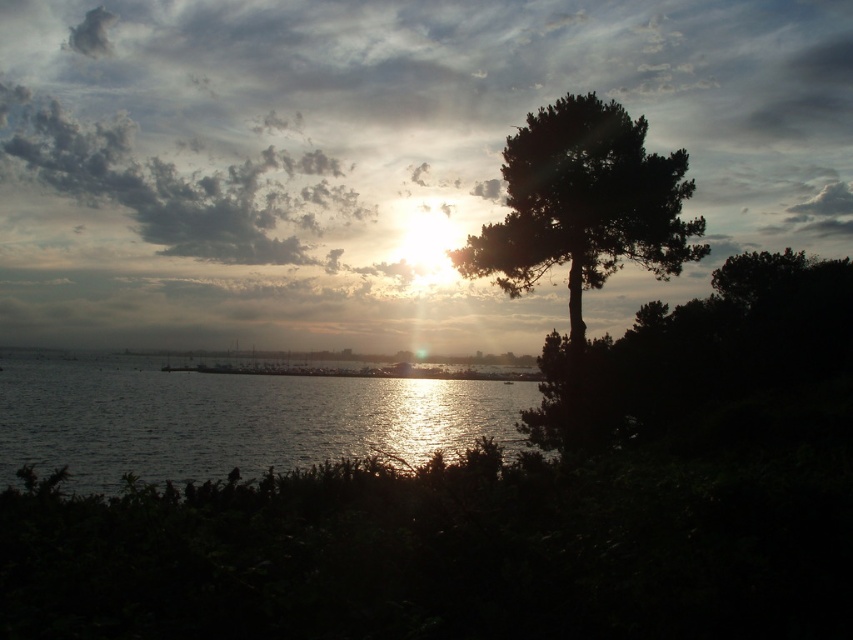
Question: Considering the relative positions of glistening water at center and dark green leafy tree at right in the image provided, where is glistening water at center located with respect to dark green leafy tree at right?

Choices:
 (A) above
 (B) below

Answer: (B)

Question: Does glistening water at center have a greater width compared to dark green leafy tree at right?

Choices:
 (A) yes
 (B) no

Answer: (A)

Question: Which point appears farthest from the camera in this image?

Choices:
 (A) (9, 468)
 (B) (602, 154)

Answer: (B)

Question: In this image, where is glistening water at center located relative to dark green leafy tree at right?

Choices:
 (A) right
 (B) left

Answer: (B)

Question: Which point is closer to the camera taking this photo?

Choices:
 (A) (560, 106)
 (B) (341, 429)

Answer: (A)